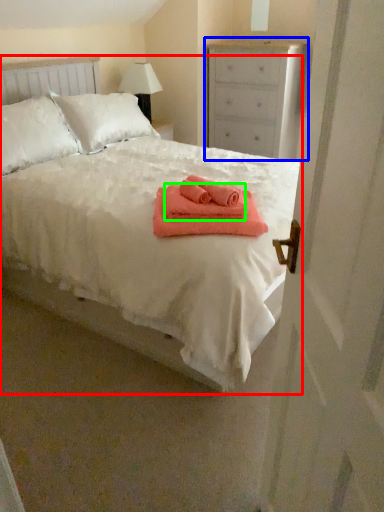
Question: Based on their relative distances, which object is farther from bed (highlighted by a red box)? Choose from chest of drawers (highlighted by a blue box) and bath towel (highlighted by a green box).

Choices:
 (A) chest of drawers
 (B) bath towel

Answer: (A)